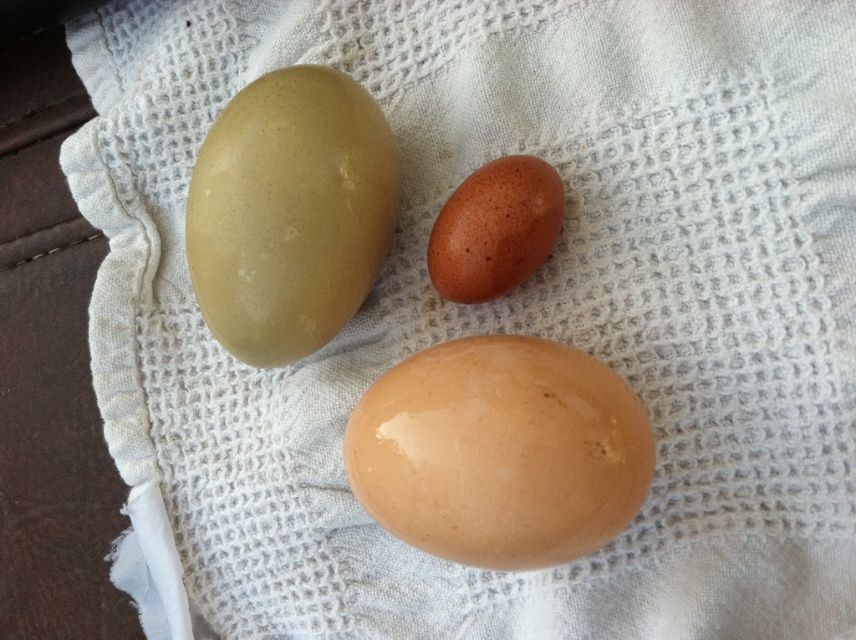
In the scene shown: You are organizing a display of eggs for an art exhibit. You have two eggs to place on a shelf that can only hold items up to 10 cm in width. The eggs are the matte brown egg at upper left and the speckled brown egg at center. Based on their sizes, which egg can safely fit on the shelf?

The speckled brown egg at center can safely fit on the shelf since it is smaller in width than the matte brown egg at upper left, which might exceed the 10 cm limit.

You are arranging eggs on a table and need to place a new egg between the glossy brown egg at center and the matte brown egg at upper left. Based on their positions, where should you place the new egg?

The glossy brown egg at center is located below the matte brown egg at upper left, so you should place the new egg between them in the space between the glossy brown egg at center and the matte brown egg at upper left.

You are an artist trying to paint the eggs arrangement. You need to know which point is closer to the viewer between point (x=580, y=435) and point (x=494, y=285). Can you tell me?

Point (x=580, y=435) is in front of point (x=494, y=285), so it is closer to the viewer.